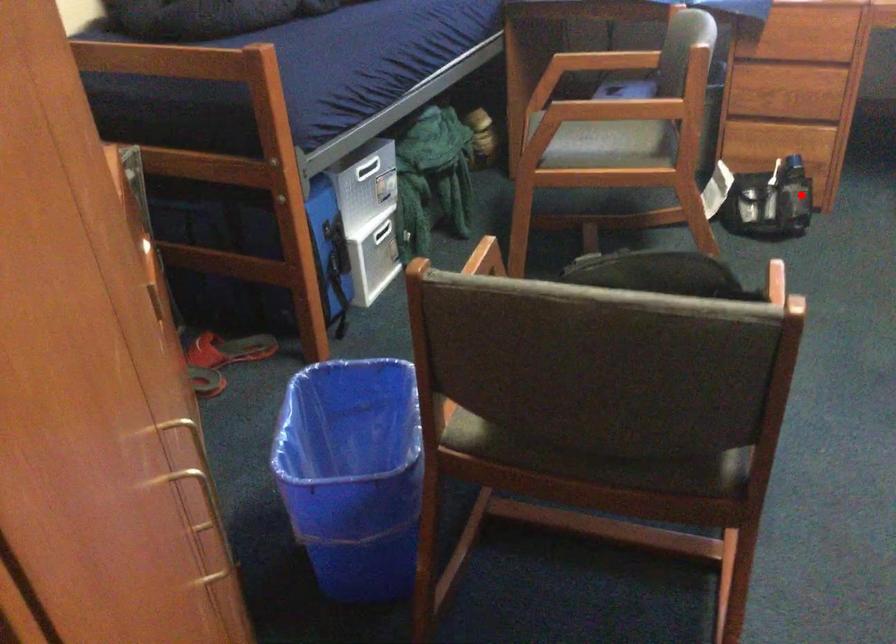
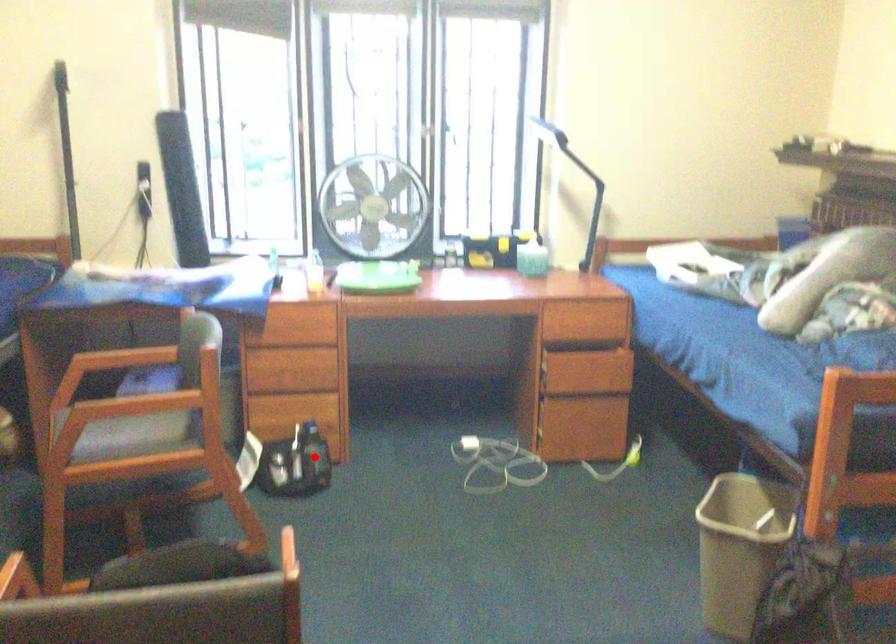
I am providing you with two images of the same scene from different viewpoints. A red point is marked on the first image and another point is marked on the second image. Is the red point in image1 aligned with the point shown in image2?

Yes